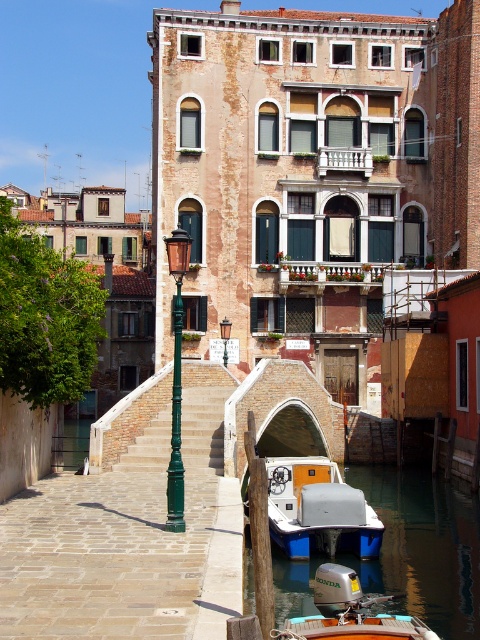
Question: Is white plastic boat at lower center further to camera compared to green concrete stairs at center?

Choices:
 (A) yes
 (B) no

Answer: (B)

Question: Estimate the real-world distances between objects in this image. Which object is farther from the green painted metal streetlamp at center-left?

Choices:
 (A) blue plastic boat at lower center
 (B) green painted metal streetlamp at center
 (C) white plastic boat at lower center

Answer: (B)

Question: Estimate the real-world distances between objects in this image. Which object is closer to the metallic silver motorboat at center?

Choices:
 (A) green concrete stairs at center
 (B) blue plastic boat at lower center

Answer: (B)

Question: Is white plastic boat at lower center positioned at the back of green painted metal streetlamp at center-left?

Choices:
 (A) yes
 (B) no

Answer: (A)

Question: Considering the real-world distances, which object is closest to the blue plastic boat at lower center?

Choices:
 (A) white plastic boat at lower center
 (B) green painted metal streetlamp at center

Answer: (A)

Question: Does blue plastic boat at lower center appear on the right side of metallic silver motorboat at center?

Choices:
 (A) no
 (B) yes

Answer: (B)